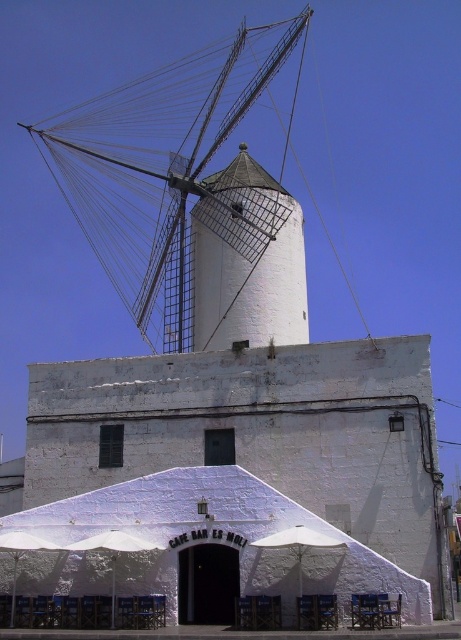
Does white painted wood windmill at upper center come in front of white fabric umbrella at lower center?

No, it is behind white fabric umbrella at lower center.

Can you confirm if white painted wood windmill at upper center is positioned above white fabric umbrella at lower center?

Correct, white painted wood windmill at upper center is located above white fabric umbrella at lower center.

Does point (128, 218) come behind point (147, 548)?

Yes, it is.

You are a GUI agent. You are given a task and a screenshot of the screen. Output one action in this format:
    pyautogui.click(x=<x>, y=<y>)
    Task: Click on the white painted wood windmill at upper center
    Image resolution: width=461 pixels, height=640 pixels.
    Given the screenshot: What is the action you would take?
    pyautogui.click(x=164, y=177)

Does white fabric canopy at lower center have a smaller size compared to white fabric umbrella at lower center?

Incorrect, white fabric canopy at lower center is not smaller in size than white fabric umbrella at lower center.

Does white fabric canopy at lower center have a lesser height compared to white fabric umbrella at lower center?

Incorrect, white fabric canopy at lower center's height does not fall short of white fabric umbrella at lower center's.

Between point (169, 561) and point (120, 532), which one is positioned in front?

Point (169, 561) is in front.

This screenshot has width=461, height=640. In order to click on white fabric canopy at lower center in this screenshot , I will do `click(219, 538)`.

Between white painted wood windmill at upper center and white fabric canopy at lower center, which one appears on the left side from the viewer's perspective?

white painted wood windmill at upper center

Can you confirm if white painted wood windmill at upper center is thinner than white fabric canopy at lower center?

No.

Is point (142, 96) closer to viewer compared to point (262, 509)?

No, (142, 96) is further to viewer.

At what (x,y) coordinates should I click in order to perform the action: click on white painted wood windmill at upper center. Please return your answer as a coordinate pair (x, y). The height and width of the screenshot is (640, 461). Looking at the image, I should click on (164, 177).